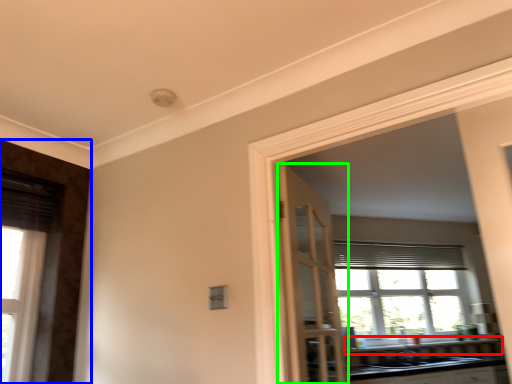
Question: Which object is the farthest from window sill (highlighted by a red box)? Choose among these: door (highlighted by a blue box) or door (highlighted by a green box).

Choices:
 (A) door
 (B) door

Answer: (A)